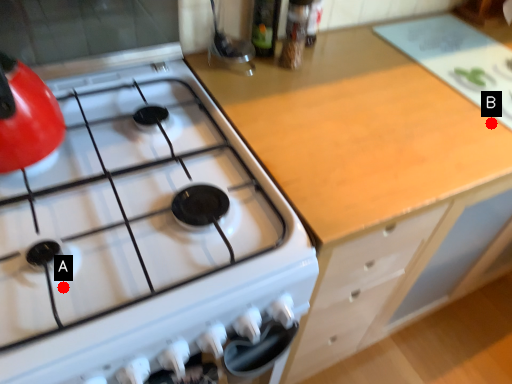
Question: Two points are circled on the image, labeled by A and B beside each circle. Which of the following is the closest to the observer?

Choices:
 (A) A is closer
 (B) B is closer

Answer: (A)